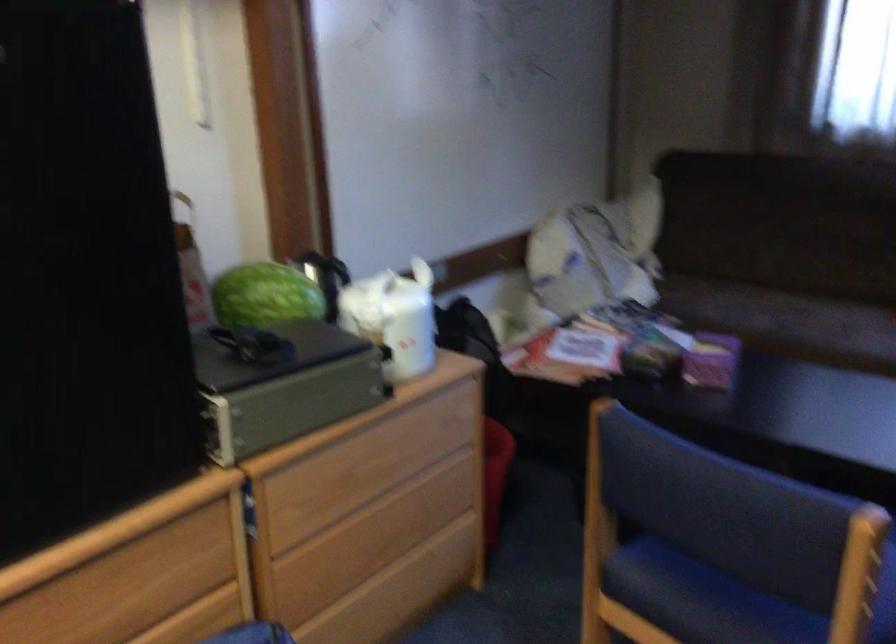
Find where to lift the white kettle handle. Please return your answer as a coordinate pair (x, y).

(426, 270)